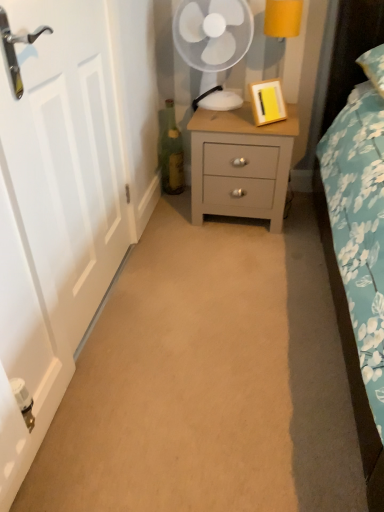
Question: Are green glass bottle at center and yellow fabric lampshade at upper right beside each other?

Choices:
 (A) yes
 (B) no

Answer: (B)

Question: Is the position of green glass bottle at center more distant than that of yellow fabric lampshade at upper right?

Choices:
 (A) no
 (B) yes

Answer: (B)

Question: Is green glass bottle at center smaller than yellow fabric lampshade at upper right?

Choices:
 (A) yes
 (B) no

Answer: (A)

Question: From a real-world perspective, does green glass bottle at center sit lower than yellow fabric lampshade at upper right?

Choices:
 (A) yes
 (B) no

Answer: (A)

Question: Is green glass bottle at center facing away from yellow fabric lampshade at upper right?

Choices:
 (A) yes
 (B) no

Answer: (B)

Question: Based on their sizes in the image, would you say yellow fabric lampshade at upper right is bigger or smaller than white plastic mechanical fan at upper center?

Choices:
 (A) small
 (B) big

Answer: (A)

Question: Is yellow fabric lampshade at upper right taller or shorter than white plastic mechanical fan at upper center?

Choices:
 (A) tall
 (B) short

Answer: (B)

Question: From a real-world perspective, is yellow fabric lampshade at upper right above or below white plastic mechanical fan at upper center?

Choices:
 (A) above
 (B) below

Answer: (B)

Question: From the image's perspective, relative to white plastic mechanical fan at upper center, is yellow fabric lampshade at upper right above or below?

Choices:
 (A) below
 (B) above

Answer: (A)

Question: Considering the relative positions of matte gray nightstand at center and white matte door at left in the image provided, is matte gray nightstand at center to the left or to the right of white matte door at left?

Choices:
 (A) left
 (B) right

Answer: (B)

Question: In terms of size, does matte gray nightstand at center appear bigger or smaller than white matte door at left?

Choices:
 (A) small
 (B) big

Answer: (B)

Question: Does point tap(243, 121) appear closer or farther from the camera than point tap(9, 245)?

Choices:
 (A) closer
 (B) farther

Answer: (B)

Question: Relative to white matte door at left, is matte gray nightstand at center in front or behind?

Choices:
 (A) behind
 (B) front

Answer: (A)

Question: Considering their positions, is white matte door at left located in front of or behind green glass bottle at center?

Choices:
 (A) behind
 (B) front

Answer: (B)

Question: Is white matte door at left bigger or smaller than green glass bottle at center?

Choices:
 (A) small
 (B) big

Answer: (B)